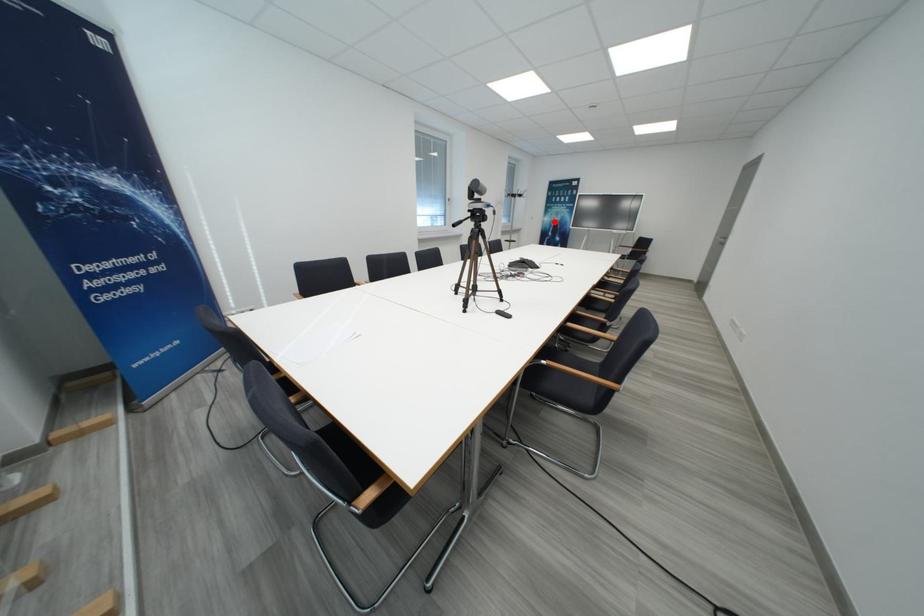
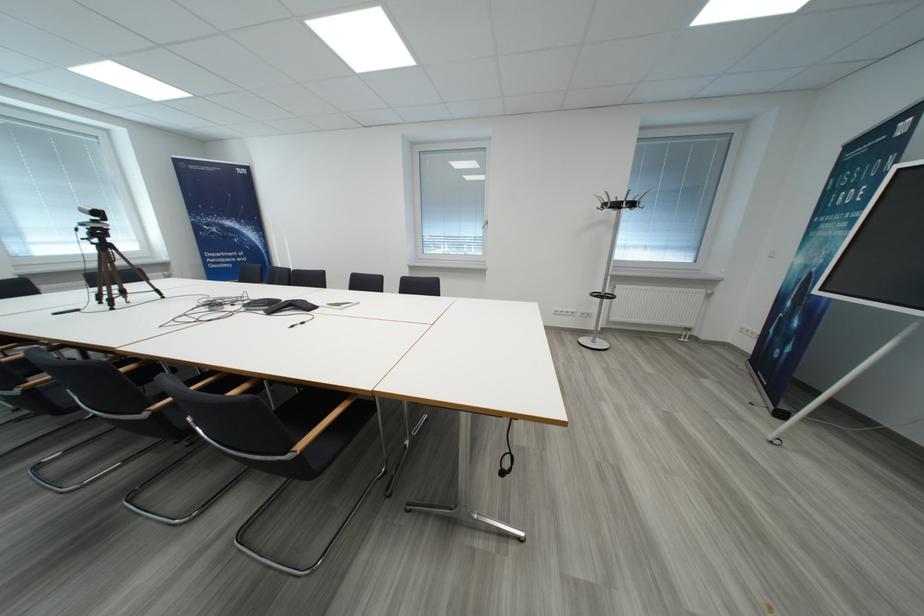
Question: I am providing you with two images of the same scene from different viewpoints. Image1 has a red point marked. In image2, the corresponding 3D location appears at what relative position? Reply with the corresponding letter.

Choices:
 (A) Closer
 (B) Farther

Answer: (B)